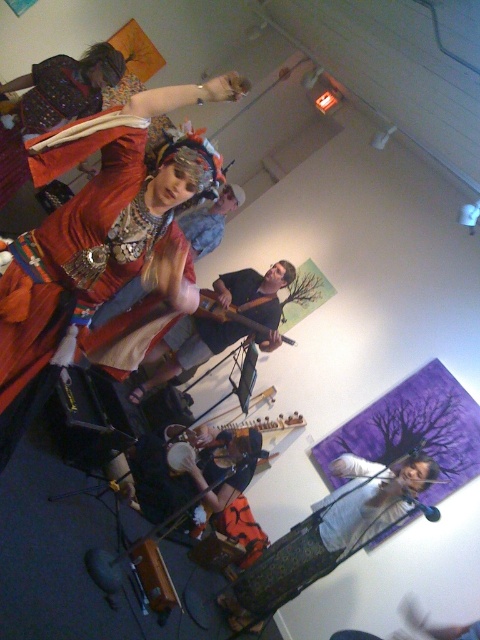
Question: Which point appears farthest from the camera in this image?

Choices:
 (A) (99, 266)
 (B) (213, 300)
 (C) (284, 429)

Answer: (C)

Question: Estimate the real-world distances between objects in this image. Which object is farther from the wooden acoustic guitar at center?

Choices:
 (A) matte red dress at center
 (B) white fabric shirt at center

Answer: (A)

Question: In this image, where is white fabric shirt at center located relative to wooden stringed instrument at center?

Choices:
 (A) left
 (B) right

Answer: (B)

Question: Where is matte red dress at center located in relation to wooden stringed instrument at center in the image?

Choices:
 (A) right
 (B) left

Answer: (B)

Question: Which object is farther from the camera taking this photo?

Choices:
 (A) matte red dress at center
 (B) white fabric shirt at center
 (C) wooden stringed instrument at center

Answer: (C)

Question: Is white fabric shirt at center smaller than wooden stringed instrument at center?

Choices:
 (A) yes
 (B) no

Answer: (B)